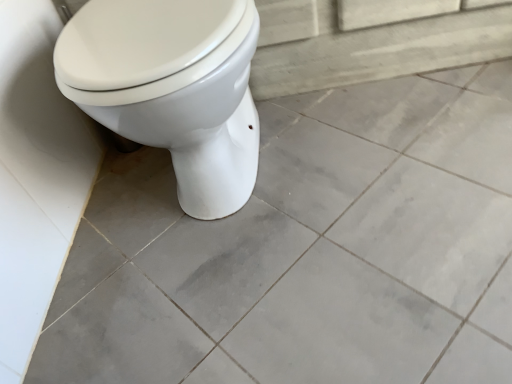
You are a GUI agent. You are given a task and a screenshot of the screen. Output one action in this format:
    pyautogui.click(x=<x>, y=<y>)
    Task: Click on the vacant space situated on the left part of white glossy toilet at center
    This screenshot has width=512, height=384.
    Given the screenshot: What is the action you would take?
    pyautogui.click(x=110, y=216)